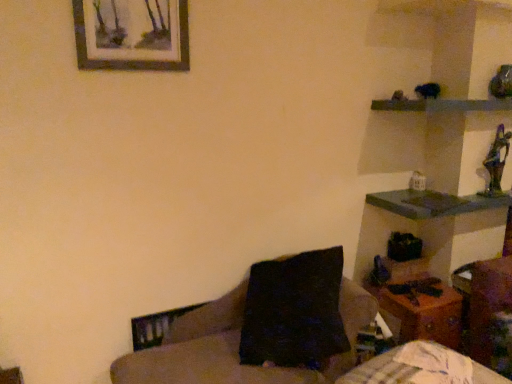
Question: From the image's perspective, is wooden shelf at upper right above or below dark brown fabric couch at center?

Choices:
 (A) above
 (B) below

Answer: (A)

Question: Choose the correct answer: Is wooden shelf at upper right inside dark brown fabric couch at center or outside it?

Choices:
 (A) outside
 (B) inside

Answer: (A)

Question: Which is nearer to the wooden shelf at upper right?

Choices:
 (A) wooden picture frame at upper left
 (B) wooden table at lower right
 (C) dark brown fabric couch at center

Answer: (B)

Question: Considering the real-world distances, which object is farthest from the dark brown fabric couch at center?

Choices:
 (A) wooden picture frame at upper left
 (B) wooden table at lower right
 (C) wooden shelf at upper right

Answer: (C)